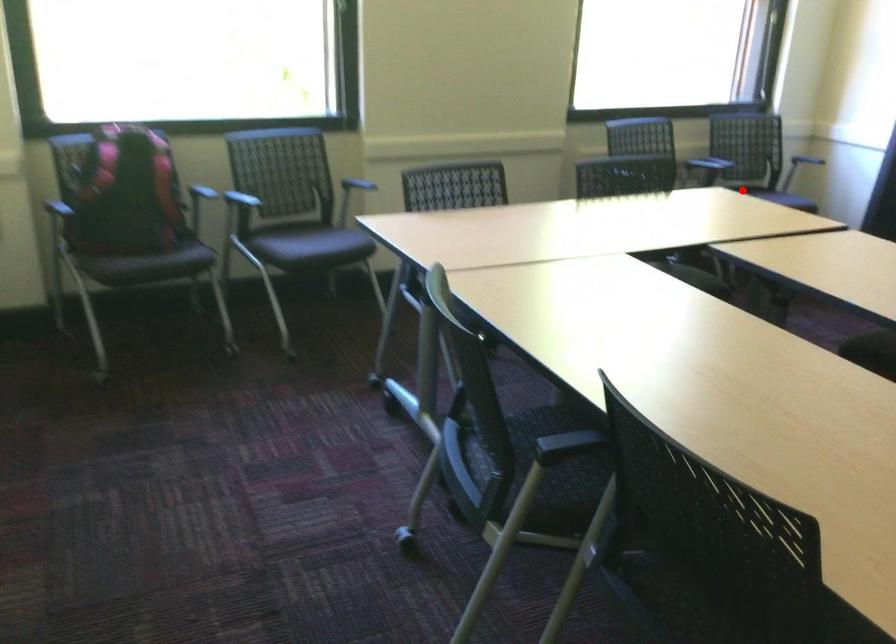
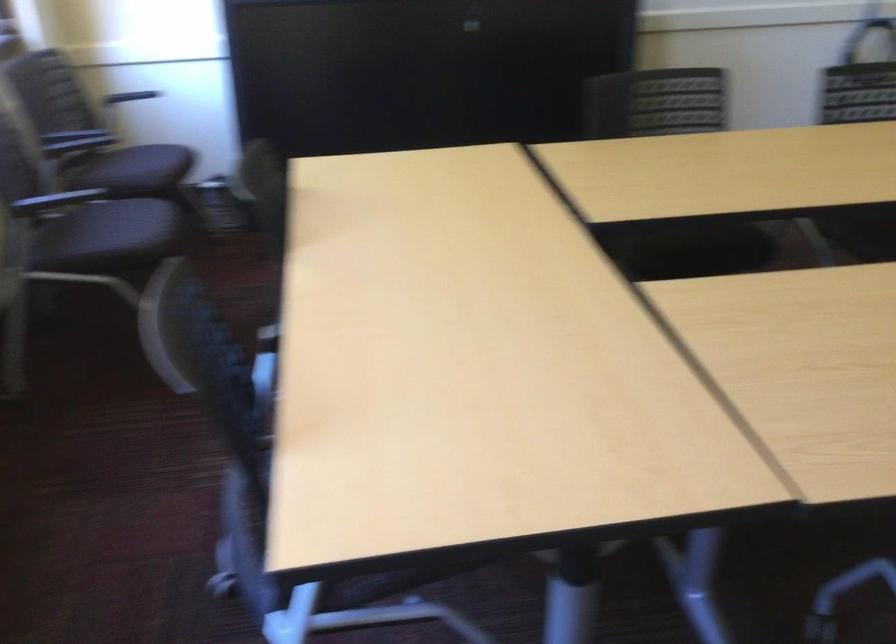
Locate, in the second image, the point that corresponds to the highlighted location in the first image.

(135, 169)